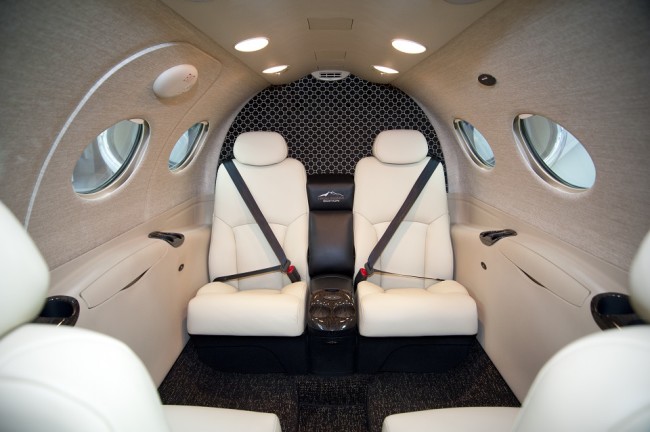
Image resolution: width=650 pixels, height=432 pixels. In order to click on wall in this screenshot , I will do `click(23, 107)`.